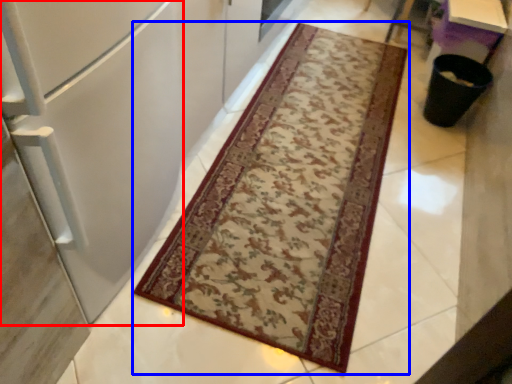
Question: Which point is further to the camera, fridge (highlighted by a red box) or mat (highlighted by a blue box)?

Choices:
 (A) fridge
 (B) mat

Answer: (B)